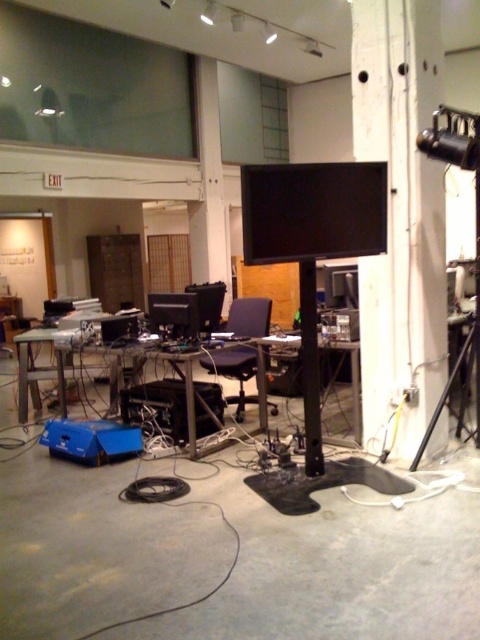
Question: Which of the following is the closest to the observer?

Choices:
 (A) black plastic swivel chair at center
 (B) metallic gray table at center
 (C) wooden pillar at center-right
 (D) black matte monitor at center

Answer: (D)

Question: Which of the following is the farthest from the observer?

Choices:
 (A) wooden pillar at center-right
 (B) black plastic table at center
 (C) black plastic swivel chair at center
 (D) black matte tripod at right

Answer: (C)

Question: Is black matte monitor at center thinner than black plastic swivel chair at center?

Choices:
 (A) yes
 (B) no

Answer: (B)

Question: Can you confirm if black matte monitor at center is wider than black plastic table at center?

Choices:
 (A) no
 (B) yes

Answer: (B)

Question: Among these objects, which one is nearest to the camera?

Choices:
 (A) metallic gray table at center
 (B) wooden pillar at center-right
 (C) black matte tripod at right

Answer: (C)

Question: Can you confirm if black matte monitor at center is smaller than black plastic swivel chair at center?

Choices:
 (A) yes
 (B) no

Answer: (A)